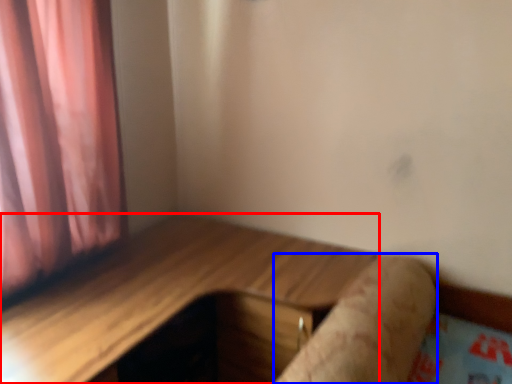
Question: Which object is closer to the camera taking this photo, table (highlighted by a red box) or log (highlighted by a blue box)?

Choices:
 (A) table
 (B) log

Answer: (A)